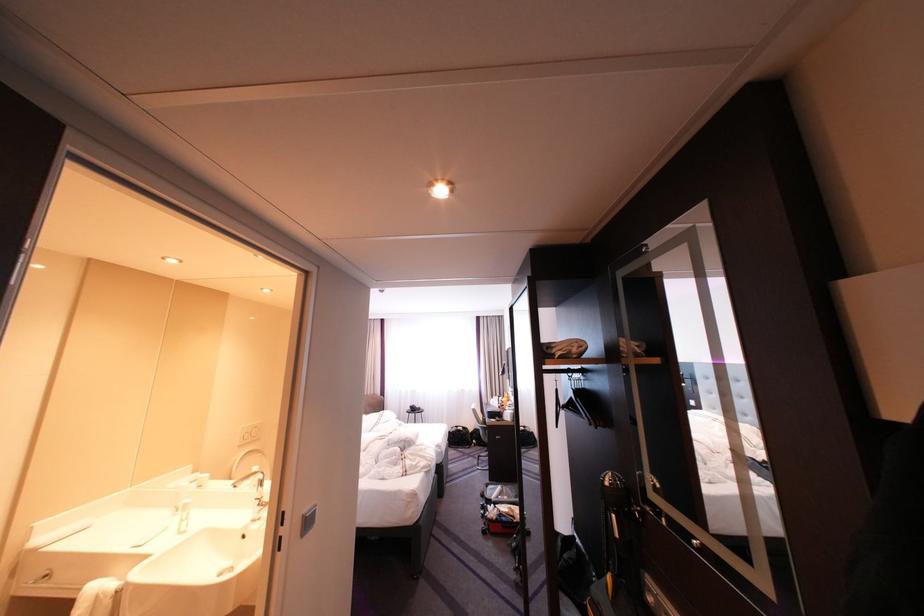
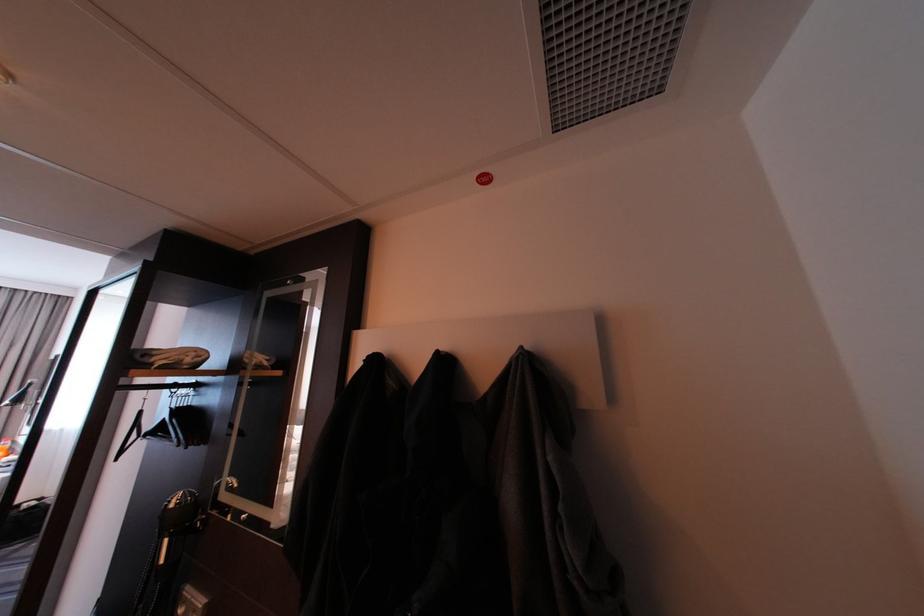
Question: Based on the continuous images, in which direction is the camera rotating? Reply with the corresponding letter.

Choices:
 (A) Left
 (B) Right
 (C) Up
 (D) Down

Answer: (B)